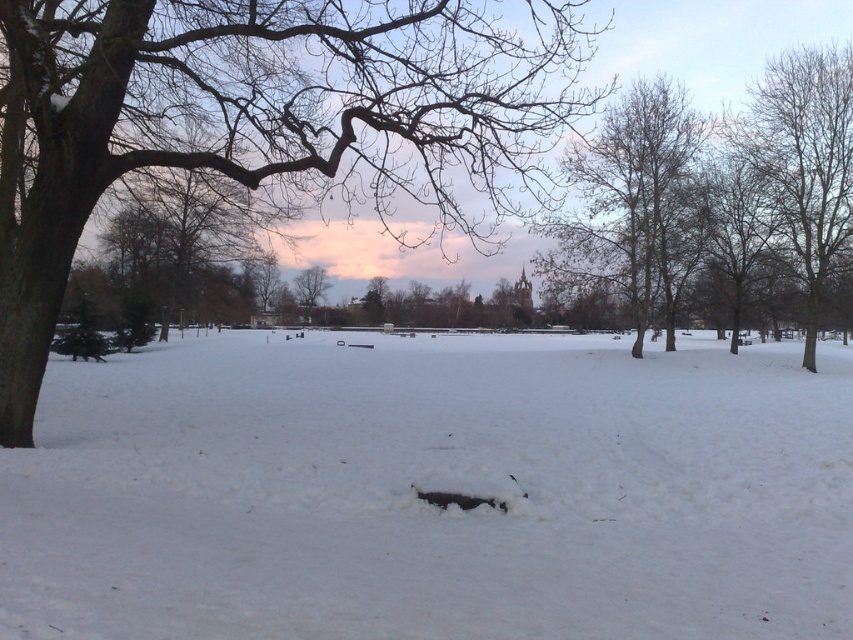
Can you confirm if bare branches at center is positioned to the right of bare branches at right?

Incorrect, bare branches at center is not on the right side of bare branches at right.

This screenshot has height=640, width=853. Describe the element at coordinates (633, 204) in the screenshot. I see `bare branches at center` at that location.

Find the location of a particular element. bare branches at center is located at coordinates (633, 204).

Looking at this image, measure the distance between smooth bark tree at left and bare branches at center.

→ They are 8.08 meters apart.

Can you confirm if smooth bark tree at left is wider than bare branches at center?

Correct, the width of smooth bark tree at left exceeds that of bare branches at center.

The image size is (853, 640). Identify the location of smooth bark tree at left. (260, 120).

Who is more distant from viewer, (209,140) or (809,324)?

Point (809,324)

Is point (560, 122) positioned in front of point (751, 156)?

No, it is not.

Measure the distance between point (x=187, y=104) and camera.

22.88 meters

Identify the location of smooth bark tree at left. The image size is (853, 640). (260, 120).